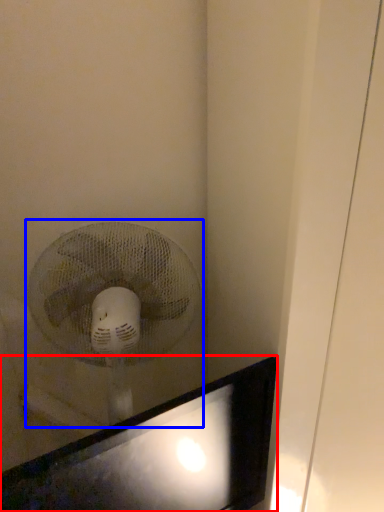
Question: Which point is closer to the camera, computer monitor (highlighted by a red box) or mechanical fan (highlighted by a blue box)?

Choices:
 (A) computer monitor
 (B) mechanical fan

Answer: (A)